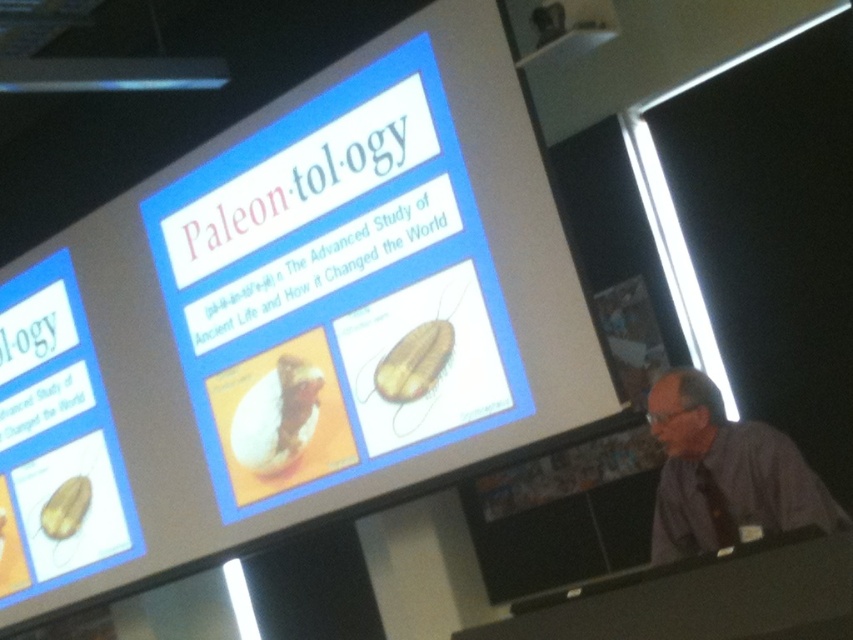
Which is more to the left, blue matte sign at center or purple shirt at lower right?

From the viewer's perspective, blue matte sign at center appears more on the left side.

Can you confirm if blue matte sign at center is taller than purple shirt at lower right?

Yes.

Who is more distant from viewer, (357, 195) or (677, 433)?

The point (357, 195) is more distant.

The width and height of the screenshot is (853, 640). Find the location of `blue matte sign at center`. blue matte sign at center is located at coordinates (335, 291).